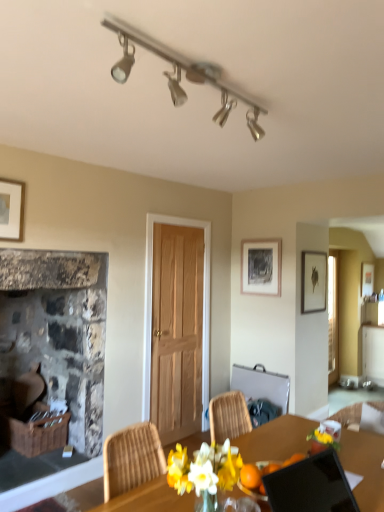
Where is `metallic silver chair at center`? The width and height of the screenshot is (384, 512). metallic silver chair at center is located at coordinates (262, 385).

The height and width of the screenshot is (512, 384). Describe the element at coordinates (313, 281) in the screenshot. I see `matte black picture frame at upper right, acting as the 1th picture frame starting from the right` at that location.

Identify the location of rustic stone fireplace at left. (58, 332).

This screenshot has height=512, width=384. Describe the element at coordinates (261, 267) in the screenshot. I see `matte black picture frame at upper center, the second picture frame viewed from the right` at that location.

At what (x,y) coordinates should I click in order to perform the action: click on satin nickel track light at upper center. Please return your answer as a coordinate pair (x, y). Image resolution: width=384 pixels, height=512 pixels. Looking at the image, I should click on (180, 74).

Does matte black picture frame at upper right, acting as the 1th picture frame starting from the right, turn towards satin nickel track light at upper center?

No, matte black picture frame at upper right, acting as the 1th picture frame starting from the right, is not turned towards satin nickel track light at upper center.

Does matte black picture frame at upper right, acting as the 1th picture frame starting from the right, lie in front of satin nickel track light at upper center?

That is False.

Is matte black picture frame at upper right, the second picture frame when ordered from left to right, directly adjacent to satin nickel track light at upper center?

No, matte black picture frame at upper right, the second picture frame when ordered from left to right, is not next to satin nickel track light at upper center.

Considering the sizes of objects matte black picture frame at upper right, the second picture frame when ordered from left to right, and satin nickel track light at upper center in the image provided, who is shorter, matte black picture frame at upper right, the second picture frame when ordered from left to right, or satin nickel track light at upper center?

satin nickel track light at upper center.

Which object is positioned more to the right, black glossy laptop at lower right or matte black picture frame at upper center, placed as the first picture frame when sorted from left to right?

matte black picture frame at upper center, placed as the first picture frame when sorted from left to right, is more to the right.

How many degrees apart are the facing directions of black glossy laptop at lower right and matte black picture frame at upper center, placed as the first picture frame when sorted from left to right?

black glossy laptop at lower right and matte black picture frame at upper center, placed as the first picture frame when sorted from left to right, are facing 85.1 degrees away from each other.

From the image's perspective, which one is positioned higher, black glossy laptop at lower right or matte black picture frame at upper center, placed as the first picture frame when sorted from left to right?

matte black picture frame at upper center, placed as the first picture frame when sorted from left to right, appears higher in the image.

In terms of height, does black glossy laptop at lower right look taller or shorter compared to matte black picture frame at upper center, placed as the first picture frame when sorted from left to right?

In the image, black glossy laptop at lower right appears to be shorter than matte black picture frame at upper center, placed as the first picture frame when sorted from left to right.

Does matte black picture frame at upper center, the second picture frame viewed from the right, have a lesser height compared to metallic silver chair at center?

Incorrect, the height of matte black picture frame at upper center, the second picture frame viewed from the right, does not fall short of that of metallic silver chair at center.

Which is more to the left, matte black picture frame at upper center, placed as the first picture frame when sorted from left to right, or metallic silver chair at center?

Positioned to the left is metallic silver chair at center.

Image resolution: width=384 pixels, height=512 pixels. I want to click on the 2nd picture frame behind the metallic silver chair at center, starting your count from the anchor, so click(x=261, y=267).

Is point (259, 255) farther from viewer compared to point (286, 400)?

That is True.

From the image's perspective, is metallic silver chair at center below black glossy laptop at lower right?

Correct, metallic silver chair at center appears lower than black glossy laptop at lower right in the image.

Does metallic silver chair at center touch black glossy laptop at lower right?

No, metallic silver chair at center is not beside black glossy laptop at lower right.

Based on the photo, considering the relative positions of metallic silver chair at center and black glossy laptop at lower right in the image provided, is metallic silver chair at center in front of black glossy laptop at lower right?

No, metallic silver chair at center is further to the viewer.

Can we say satin nickel track light at upper center lies outside black glossy laptop at lower right?

Yes, satin nickel track light at upper center is not within black glossy laptop at lower right.

Is satin nickel track light at upper center positioned with its back to black glossy laptop at lower right?

No, satin nickel track light at upper center's orientation is not away from black glossy laptop at lower right.

From the picture: Are satin nickel track light at upper center and black glossy laptop at lower right making contact?

satin nickel track light at upper center and black glossy laptop at lower right are not in contact.

From a real-world perspective, which is physically above, satin nickel track light at upper center or black glossy laptop at lower right?

From a 3D spatial view, satin nickel track light at upper center is above.

What's the angular difference between rustic stone fireplace at left and metallic silver chair at center's facing directions?

The facing directions of rustic stone fireplace at left and metallic silver chair at center are 87.6 degrees apart.

Does rustic stone fireplace at left turn towards metallic silver chair at center?

No, rustic stone fireplace at left is not turned towards metallic silver chair at center.

Considering the positions of point (102, 385) and point (271, 399), is point (102, 385) closer or farther from the camera than point (271, 399)?

Point (102, 385) is positioned closer to the camera compared to point (271, 399).

Does matte black picture frame at upper right, the second picture frame when ordered from left to right, have a smaller size compared to rustic stone fireplace at left?

Correct, matte black picture frame at upper right, the second picture frame when ordered from left to right, occupies less space than rustic stone fireplace at left.

Is matte black picture frame at upper right, the second picture frame when ordered from left to right, oriented towards rustic stone fireplace at left?

No, matte black picture frame at upper right, the second picture frame when ordered from left to right, is not oriented towards rustic stone fireplace at left.

Which object is more forward, matte black picture frame at upper right, acting as the 1th picture frame starting from the right, or rustic stone fireplace at left?

Positioned in front is rustic stone fireplace at left.

Where is `picture frame that is the 2nd one below the satin nickel track light at upper center (from a real-world perspective)`? picture frame that is the 2nd one below the satin nickel track light at upper center (from a real-world perspective) is located at coordinates (313, 281).

I want to click on laptop on the left side of matte black picture frame at upper center, the second picture frame viewed from the right, so click(311, 486).

When comparing their distances from metallic silver chair at center, does black glossy laptop at lower right or matte black picture frame at upper right, the second picture frame when ordered from left to right, seem closer?

matte black picture frame at upper right, the second picture frame when ordered from left to right, is closer to metallic silver chair at center.

Which object lies further to the anchor point black glossy laptop at lower right, rustic stone fireplace at left or matte black picture frame at upper right, the second picture frame when ordered from left to right?

Based on the image, matte black picture frame at upper right, the second picture frame when ordered from left to right, appears to be further to black glossy laptop at lower right.

Based on their spatial positions, is black glossy laptop at lower right or satin nickel track light at upper center further from rustic stone fireplace at left?

black glossy laptop at lower right is positioned further to the anchor rustic stone fireplace at left.

Consider the image. From the image, which object appears to be nearer to wooden table at center, matte black picture frame at upper right, the second picture frame when ordered from left to right, or metallic silver chair at center?

metallic silver chair at center is closer to wooden table at center.

Considering their positions, is wooden table at center positioned closer to black glossy laptop at lower right than rustic stone fireplace at left?

The object closer to black glossy laptop at lower right is wooden table at center.

Based on their spatial positions, is wooden table at center or matte black picture frame at upper center, the second picture frame viewed from the right, further from rustic stone fireplace at left?

The object further to rustic stone fireplace at left is wooden table at center.

Which object lies nearer to the anchor point satin nickel track light at upper center, metallic silver chair at center or matte black picture frame at upper right, acting as the 1th picture frame starting from the right?

The object closer to satin nickel track light at upper center is matte black picture frame at upper right, acting as the 1th picture frame starting from the right.

In the scene shown: Considering their positions, is satin nickel track light at upper center positioned further to metallic silver chair at center than matte black picture frame at upper right, the second picture frame when ordered from left to right?

satin nickel track light at upper center is positioned further to the anchor metallic silver chair at center.

This screenshot has width=384, height=512. I want to click on fireplace between satin nickel track light at upper center and matte black picture frame at upper center, placed as the first picture frame when sorted from left to right, in the front-back direction, so click(x=58, y=332).

Find the location of `picture frame between rustic stone fireplace at left and matte black picture frame at upper right, the second picture frame when ordered from left to right, in the horizontal direction`. picture frame between rustic stone fireplace at left and matte black picture frame at upper right, the second picture frame when ordered from left to right, in the horizontal direction is located at coordinates (261, 267).

In order to click on fireplace between black glossy laptop at lower right and matte black picture frame at upper center, the second picture frame viewed from the right, along the z-axis in this screenshot , I will do `click(58, 332)`.

Where is `lamp between wooden table at center and rustic stone fireplace at left along the z-axis`? This screenshot has height=512, width=384. lamp between wooden table at center and rustic stone fireplace at left along the z-axis is located at coordinates (180, 74).